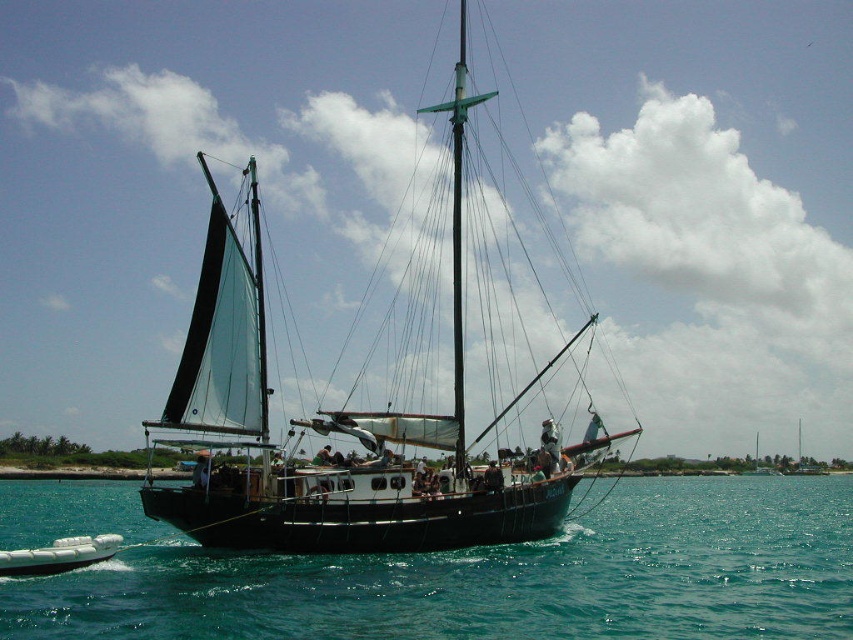
Question: Which point is closer to the camera?

Choices:
 (A) wooden sailboat at center
 (B) teal glossy water at center
 (C) white glossy dinghy at lower left

Answer: (B)

Question: Observing the image, what is the correct spatial positioning of wooden sailboat at center in reference to white glossy dinghy at lower left?

Choices:
 (A) below
 (B) above

Answer: (B)

Question: Is teal glossy water at center to the left of white glossy dinghy at lower left from the viewer's perspective?

Choices:
 (A) no
 (B) yes

Answer: (A)

Question: Among these points, which one is farthest from the camera?

Choices:
 (A) (183, 605)
 (B) (358, 515)
 (C) (0, 576)

Answer: (B)

Question: Does teal glossy water at center come behind wooden sailboat at center?

Choices:
 (A) no
 (B) yes

Answer: (A)

Question: Which is farther from the white glossy dinghy at lower left?

Choices:
 (A) wooden sailboat at center
 (B) teal glossy water at center

Answer: (B)